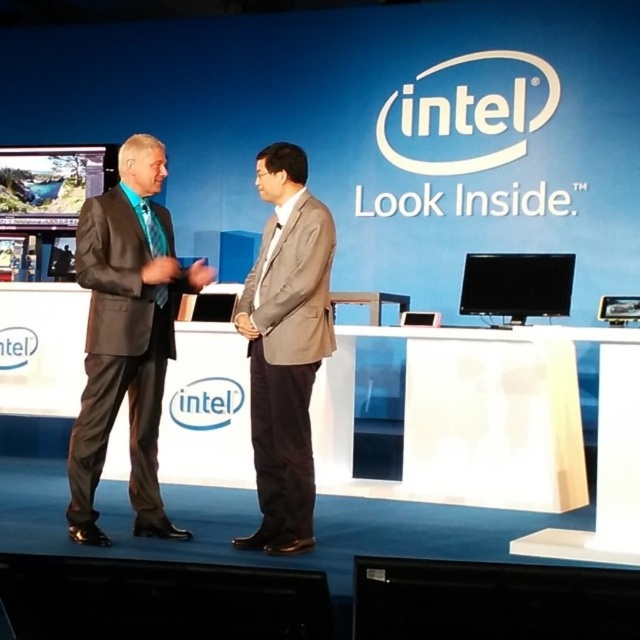
Question: Which point is closer to the camera taking this photo?

Choices:
 (A) (292, 381)
 (B) (77, 216)

Answer: (A)

Question: Which of the following is the farthest from the observer?

Choices:
 (A) (140, 259)
 (B) (266, 253)

Answer: (B)

Question: Can you confirm if matte black suit at left is positioned below light brown fabric suit at center?

Choices:
 (A) yes
 (B) no

Answer: (B)

Question: Is matte black suit at left smaller than light brown fabric suit at center?

Choices:
 (A) yes
 (B) no

Answer: (B)

Question: Does matte black suit at left have a greater width compared to light brown fabric suit at center?

Choices:
 (A) yes
 (B) no

Answer: (A)

Question: Which point is closer to the camera?

Choices:
 (A) (252, 544)
 (B) (116, 282)

Answer: (B)